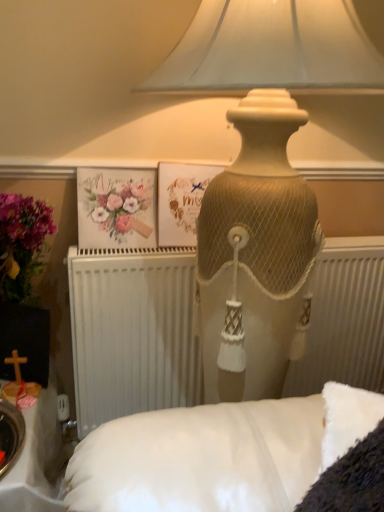
Question: Does matte beige lamp at upper center come behind white textured radiator at center?

Choices:
 (A) yes
 (B) no

Answer: (B)

Question: Is matte beige lamp at upper center wider than white textured radiator at center?

Choices:
 (A) yes
 (B) no

Answer: (A)

Question: Is matte beige lamp at upper center facing away from white textured radiator at center?

Choices:
 (A) no
 (B) yes

Answer: (B)

Question: Does matte beige lamp at upper center have a larger size compared to white textured radiator at center?

Choices:
 (A) yes
 (B) no

Answer: (A)

Question: Is matte beige lamp at upper center next to white textured radiator at center and touching it?

Choices:
 (A) no
 (B) yes

Answer: (A)

Question: Can we say matte beige lamp at upper center lies outside white textured radiator at center?

Choices:
 (A) yes
 (B) no

Answer: (A)

Question: Are matte beige lamp at upper center and watercolor paper flowers at upper left making contact?

Choices:
 (A) no
 (B) yes

Answer: (A)

Question: Can you confirm if matte beige lamp at upper center is wider than watercolor paper flowers at upper left?

Choices:
 (A) no
 (B) yes

Answer: (B)

Question: Can you confirm if matte beige lamp at upper center is bigger than watercolor paper flowers at upper left?

Choices:
 (A) no
 (B) yes

Answer: (B)

Question: Does matte beige lamp at upper center appear on the left side of watercolor paper flowers at upper left?

Choices:
 (A) yes
 (B) no

Answer: (B)

Question: Could you tell me if matte beige lamp at upper center is facing watercolor paper flowers at upper left?

Choices:
 (A) no
 (B) yes

Answer: (A)

Question: From the image's perspective, does matte beige lamp at upper center appear lower than watercolor paper flowers at upper left?

Choices:
 (A) yes
 (B) no

Answer: (A)

Question: Is watercolor paper flowers at upper left thinner than white textured radiator at center?

Choices:
 (A) no
 (B) yes

Answer: (B)